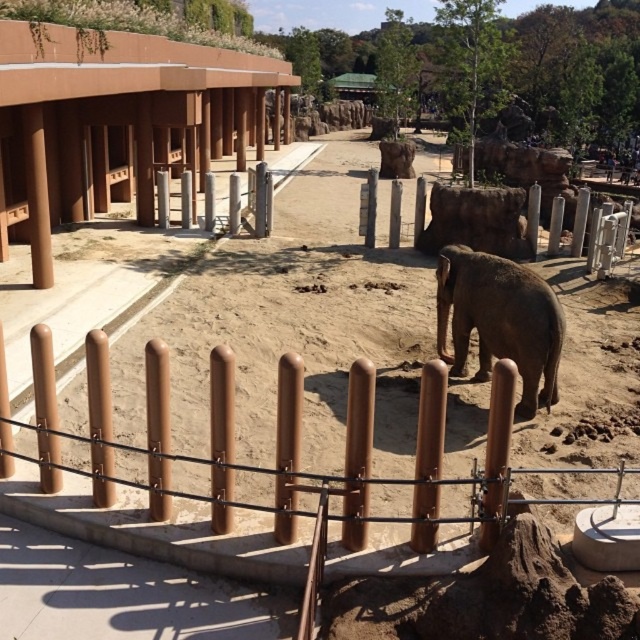
Is brown matte fence at center above gray matte elephant at center?

Actually, brown matte fence at center is below gray matte elephant at center.

Does point (148, 408) come in front of point (504, 268)?

That is True.

Where is `brown matte fence at center`? brown matte fence at center is located at coordinates (275, 444).